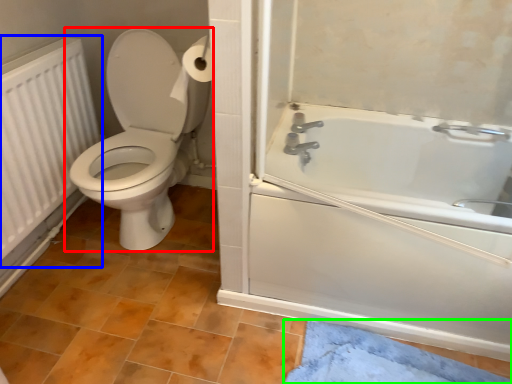
Question: Estimate the real-world distances between objects in this image. Which object is farther from toilet (highlighted by a red box), radiator (highlighted by a blue box) or bath mat (highlighted by a green box)?

Choices:
 (A) radiator
 (B) bath mat

Answer: (B)